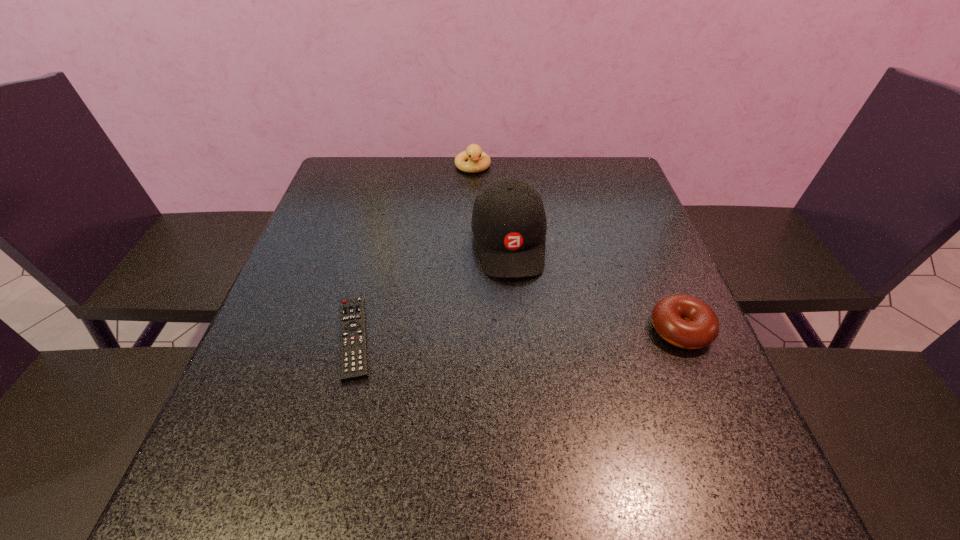
This screenshot has height=540, width=960. In order to click on free space on the desktop that is between the shortest object and the second shortest object and is positioned with a logo on the front of the baseball cap in this screenshot , I will do `click(524, 334)`.

Where is `free space on the desktop that is between the shortest object and the second shortest object and is positioned at the beak of the farthest object`? Image resolution: width=960 pixels, height=540 pixels. free space on the desktop that is between the shortest object and the second shortest object and is positioned at the beak of the farthest object is located at coordinates (516, 334).